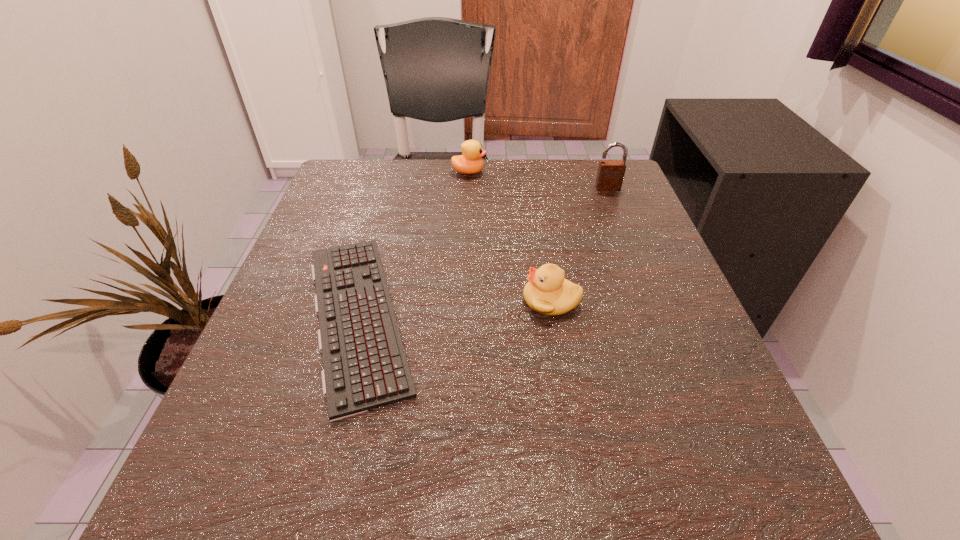
You are a GUI agent. You are given a task and a screenshot of the screen. Output one action in this format:
    pyautogui.click(x=<x>, y=<y>)
    Task: Click on the vacant space located at the face of the right duckling
    The width and height of the screenshot is (960, 540).
    Given the screenshot: What is the action you would take?
    pyautogui.click(x=454, y=300)

The height and width of the screenshot is (540, 960). I want to click on vacant area situated at the face of the right duckling, so click(x=369, y=300).

In order to click on vacant space located 0.060m at the face of the right duckling in this screenshot , I will do `click(489, 300)`.

What are the coordinates of `vacant position located 0.370m on the right of the computer keyboard` in the screenshot? It's located at (645, 315).

Identify the location of padlock present at the far edge. The height and width of the screenshot is (540, 960). (610, 175).

Locate an element on the screen. duckling that is at the far edge is located at coordinates (470, 162).

Locate an element on the screen. Image resolution: width=960 pixels, height=540 pixels. object that is at the left edge is located at coordinates [x=365, y=366].

Identify the location of object located in the right edge section of the desktop. This screenshot has width=960, height=540. [x=610, y=175].

Where is `object that is positioned at the far right corner`? object that is positioned at the far right corner is located at coordinates (610, 175).

This screenshot has width=960, height=540. Identify the location of free space at the far edge of the desktop. pyautogui.click(x=408, y=192).